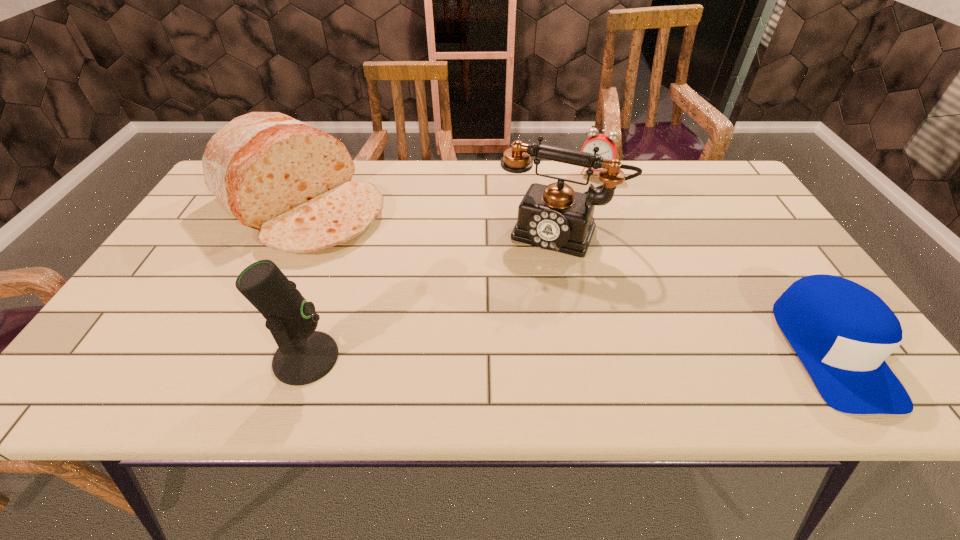
The width and height of the screenshot is (960, 540). I want to click on blank space located on the front-facing side of the alarm clock, so click(x=579, y=206).

You are a GUI agent. You are given a task and a screenshot of the screen. Output one action in this format:
    pyautogui.click(x=<x>, y=<y>)
    Task: Click on the free region located 0.150m on the front-facing side of the alarm clock
    The height and width of the screenshot is (540, 960).
    Given the screenshot: What is the action you would take?
    (579, 206)

This screenshot has width=960, height=540. I want to click on vacant space located at the sliced end of the bread, so click(395, 269).

This screenshot has height=540, width=960. Identify the location of free space located 0.290m at the sliced end of the bread. (431, 296).

Identify the location of free space located 0.100m at the sliced end of the bread. The height and width of the screenshot is (540, 960). (379, 259).

In order to click on alarm clock at the far edge in this screenshot , I will do `click(607, 147)`.

Identify the location of bread that is at the far edge. (292, 182).

The width and height of the screenshot is (960, 540). Identify the location of microphone located at the near edge. (304, 355).

Locate an element on the screen. baseball cap located at the near edge is located at coordinates (842, 332).

Image resolution: width=960 pixels, height=540 pixels. I want to click on object located in the left edge section of the desktop, so click(x=292, y=182).